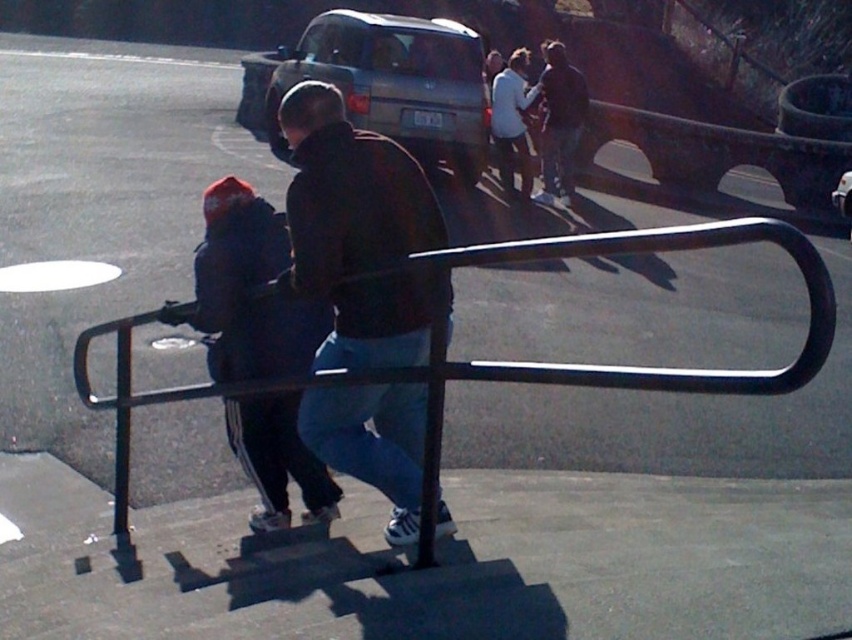
You are trying to determine if the dark brown leather jacket at center can fit into a storage box that is the same width as the dark blue jeans at center. Based on the scene description, will it fit?

The dark brown leather jacket at center has a width less than the dark blue jeans at center, so it will fit into the storage box with the same width as the jeans.

You are standing at the origin point of the coordinate system. The image has a coordinate system where the bottom left corner is the origin. You want to walk to the dark blue fabric jacket at left. Which direction should you move first?

Since the dark blue fabric jacket at left is located at coordinate point 0.452 on the x axis and 0.292 on the y axis, you should first move to the right along the x axis to reach the jacket.

You are a pedestrian trying to cross the road and see the dark blue fabric jacket at left and the silver metallic suv at center. Which object is closer to you?

The dark blue fabric jacket at left is closer to you because it is in front of the silver metallic suv at center.